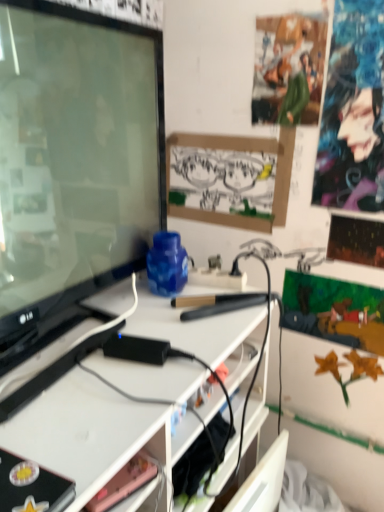
Question: Is matte black tv at left bigger or smaller than matte black book at lower left?

Choices:
 (A) small
 (B) big

Answer: (B)

Question: Considering their positions, is matte black tv at left located in front of or behind matte black book at lower left?

Choices:
 (A) front
 (B) behind

Answer: (B)

Question: Estimate the real-world distances between objects in this image. Which object is farther from the matte black tv at left?

Choices:
 (A) purple glossy poster at upper right
 (B) black paperboard at center
 (C) matte black book at lower left
 (D) pink matte phone at lower center
 (E) green fabric poster at upper center

Answer: (A)

Question: Estimate the real-world distances between objects in this image. Which object is closer to the green fabric poster at upper center?

Choices:
 (A) pink matte phone at lower center
 (B) purple glossy poster at upper right
 (C) matte black book at lower left
 (D) black paperboard at center
 (E) matte black tv at left

Answer: (B)